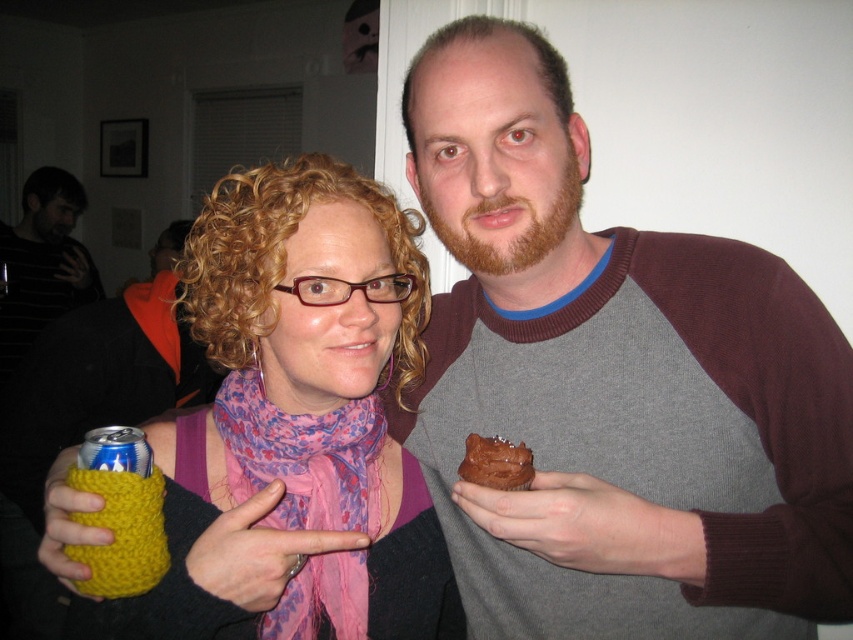
Is point (782, 636) less distant than point (311, 419)?

No.

Identify the location of gray marled sweater at center. (614, 384).

Which is behind, point (753, 406) or point (328, 524)?

The point (328, 524) is behind.

Where is `gray marled sweater at center`? gray marled sweater at center is located at coordinates (614, 384).

Is gray marled sweater at center taller than yellow knitted can at left?

Yes, gray marled sweater at center is taller than yellow knitted can at left.

Can you confirm if gray marled sweater at center is thinner than yellow knitted can at left?

Incorrect, gray marled sweater at center's width is not less than yellow knitted can at left's.

This screenshot has height=640, width=853. What do you see at coordinates (614, 384) in the screenshot? I see `gray marled sweater at center` at bounding box center [614, 384].

This screenshot has height=640, width=853. What are the coordinates of `gray marled sweater at center` in the screenshot? It's located at (614, 384).

Is gray marled sweater at center to the right of chocolate matte cake at center from the viewer's perspective?

Correct, you'll find gray marled sweater at center to the right of chocolate matte cake at center.

Describe the element at coordinates (614, 384) in the screenshot. I see `gray marled sweater at center` at that location.

Find the location of a particular element. gray marled sweater at center is located at coordinates (614, 384).